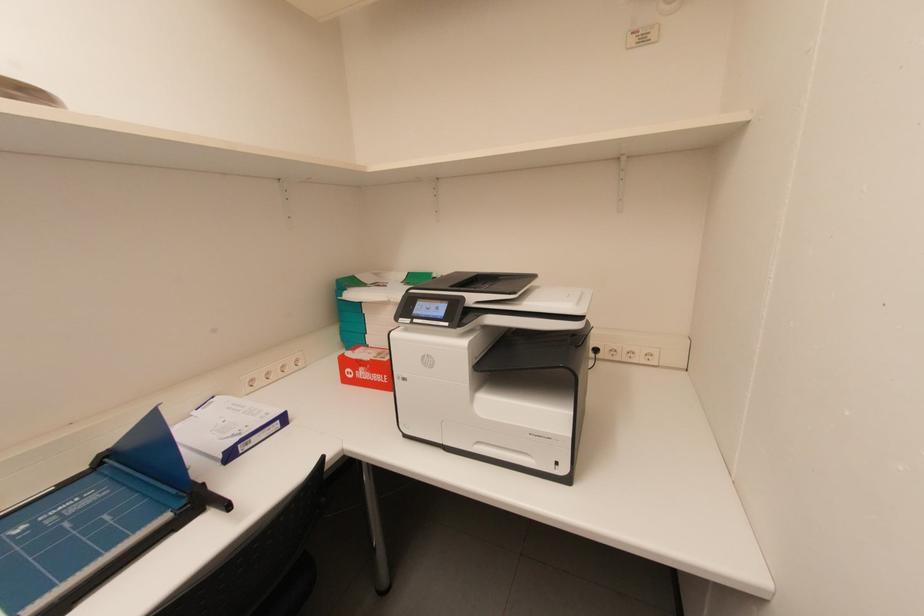
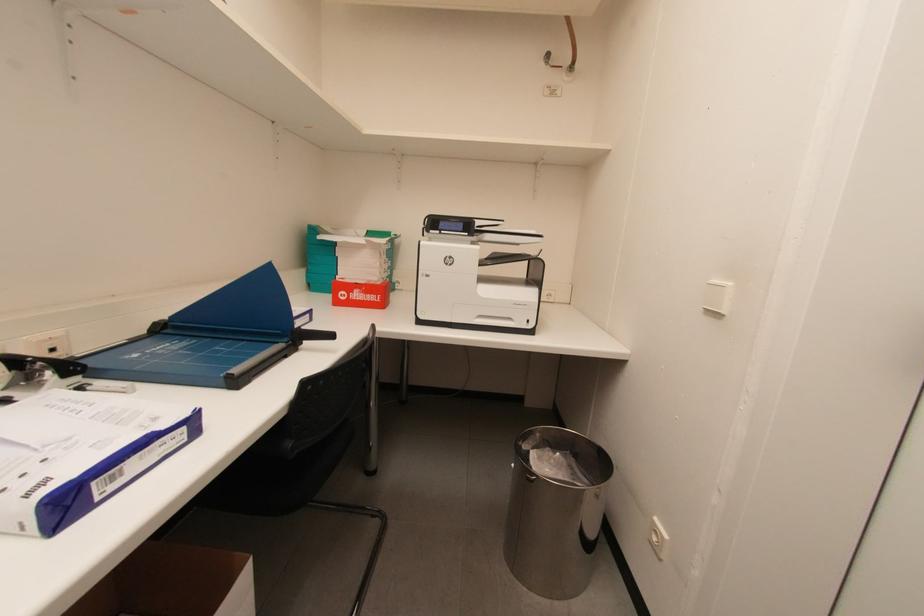
Question: The first image is from the beginning of the video and the second image is from the end. How did the camera likely rotate when shooting the video?

Choices:
 (A) Left
 (B) Right
 (C) Up
 (D) Down

Answer: (B)